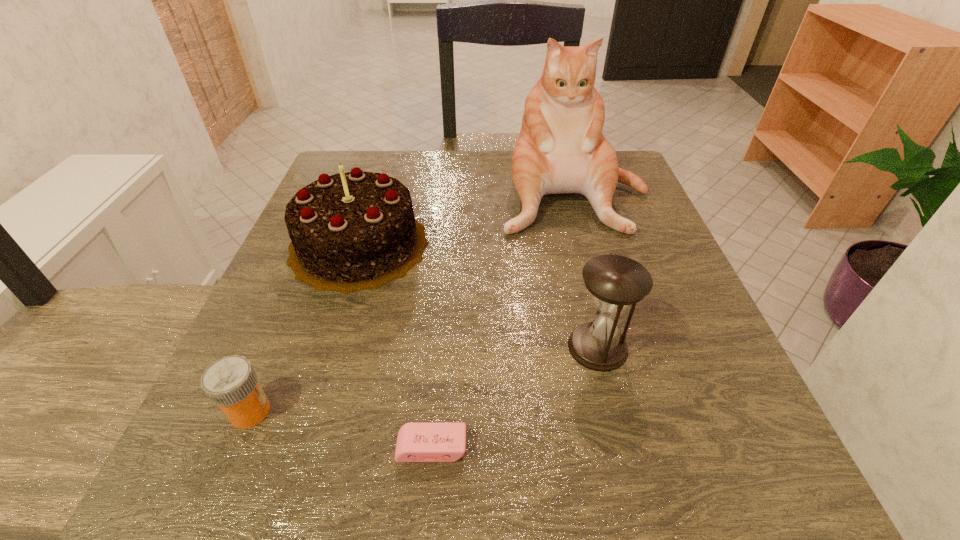
Where is `free space that satisfies the following two spatial constraints: 1. on the back side of the third nearest object; 2. on the left side of the nearest object`? free space that satisfies the following two spatial constraints: 1. on the back side of the third nearest object; 2. on the left side of the nearest object is located at coordinates (440, 347).